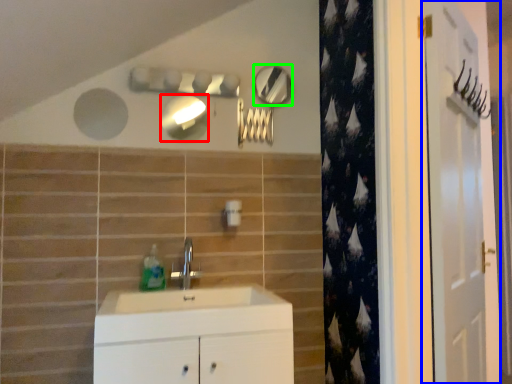
Question: Based on their relative distances, which object is farther from mirror (highlighted by a red box)? Choose from door (highlighted by a blue box) and mirror (highlighted by a green box).

Choices:
 (A) door
 (B) mirror

Answer: (A)